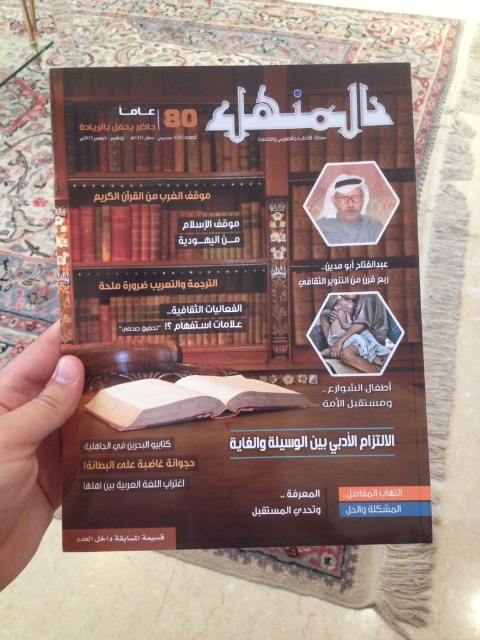
Can you confirm if open book at center is taller than hardcover book at center?

Correct, open book at center is much taller as hardcover book at center.

Is open book at center positioned in front of hardcover book at center?

Yes, it is.

Identify the location of open book at center. (171, 304).

How far apart are dark brown wooden bookshelf at upper center and skin tonewoodenhand at left?

11.43 centimeters

Between dark brown wooden bookshelf at upper center and skin tonewoodenhand at left, which one appears on the right side from the viewer's perspective?

Positioned to the right is dark brown wooden bookshelf at upper center.

Is point (195, 67) behind point (27, 481)?

Yes, it is.

Image resolution: width=480 pixels, height=640 pixels. I want to click on dark brown wooden bookshelf at upper center, so click(235, 307).

Is point (194, 240) closer to camera compared to point (88, 401)?

No, (194, 240) is behind (88, 401).

Is hardcover book at center smaller than matte paper book at center?

Indeed, hardcover book at center has a smaller size compared to matte paper book at center.

Locate an element on the screen. The width and height of the screenshot is (480, 640). hardcover book at center is located at coordinates (164, 234).

Locate an element on the screen. Image resolution: width=480 pixels, height=640 pixels. hardcover book at center is located at coordinates (164, 234).